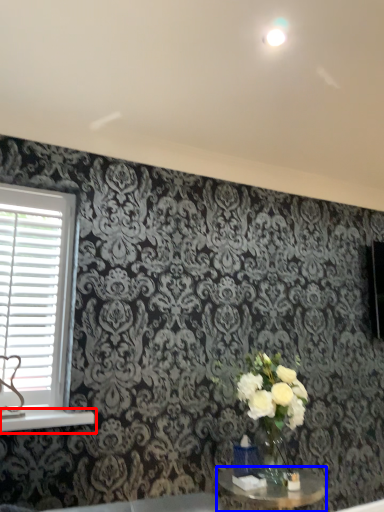
Question: Which point is further to the camera, window sill (highlighted by a red box) or table (highlighted by a blue box)?

Choices:
 (A) window sill
 (B) table

Answer: (A)